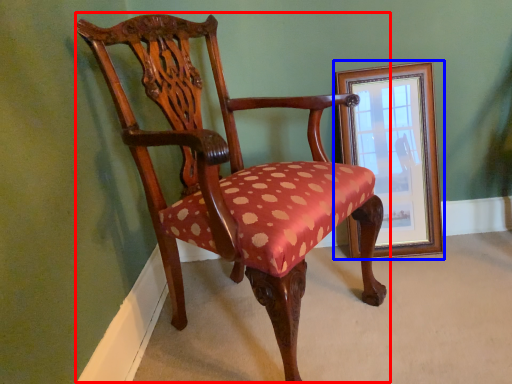
Question: Which object is further to the camera taking this photo, chair (highlighted by a red box) or picture frame (highlighted by a blue box)?

Choices:
 (A) chair
 (B) picture frame

Answer: (B)